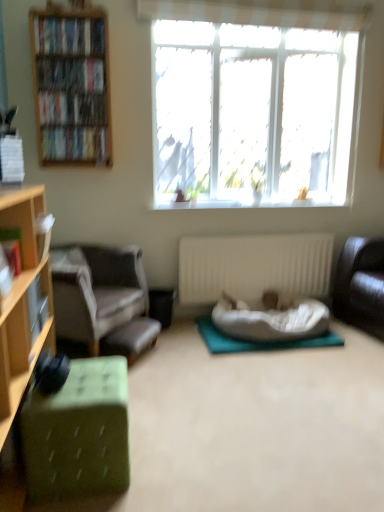
You are a GUI agent. You are given a task and a screenshot of the screen. Output one action in this format:
    pyautogui.click(x=<x>, y=<y>)
    Task: Click on the free spot above hardcover books at left, which is the third book from back to front (from a real-world perspective)
    The image size is (384, 512).
    Given the screenshot: What is the action you would take?
    pyautogui.click(x=80, y=58)